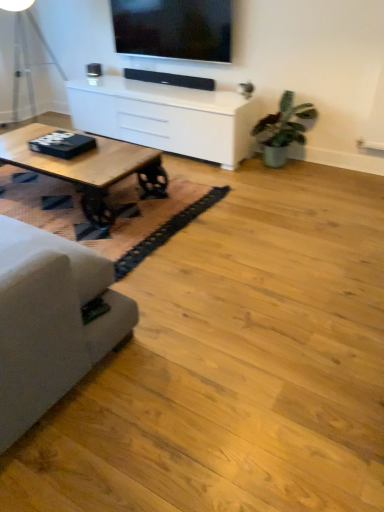
Question: Considering the relative positions of matte black tv at upper center and green matte plant at right in the image provided, is matte black tv at upper center to the left or to the right of green matte plant at right?

Choices:
 (A) left
 (B) right

Answer: (A)

Question: Considering their positions, is matte black tv at upper center located in front of or behind green matte plant at right?

Choices:
 (A) front
 (B) behind

Answer: (B)

Question: Which of these objects is positioned closest to the matte black tv at upper center?

Choices:
 (A) white glossy cabinet at upper center
 (B) suede gray couch at left
 (C) metallic silver table lamp at left
 (D) green matte plant at right
 (E) wooden table at left

Answer: (A)

Question: Estimate the real-world distances between objects in this image. Which object is closer to the wooden table at left?

Choices:
 (A) metallic silver table lamp at left
 (B) matte black tv at upper center
 (C) black woven mat at lower left
 (D) green matte plant at right
 (E) white glossy cabinet at upper center

Answer: (C)